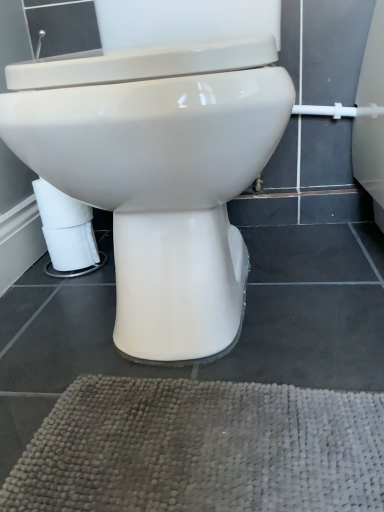
Question: Should I look upward or downward to see white glossy toilet at center?

Choices:
 (A) down
 (B) up

Answer: (B)